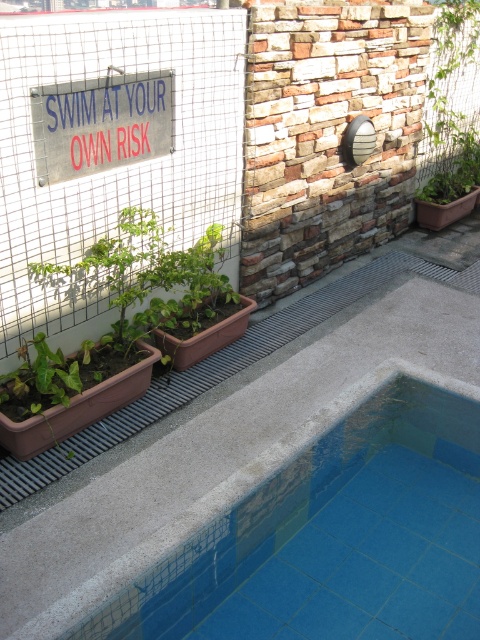
Question: Which object is the farthest from the blue tile swimming pool at lower center?

Choices:
 (A) metallic sign at upper left
 (B) green leafy plant at upper right

Answer: (B)

Question: Among these objects, which one is farthest from the camera?

Choices:
 (A) green leafy plant at upper right
 (B) metallic sign at upper left
 (C) blue tile swimming pool at lower center

Answer: (A)

Question: Is blue tile swimming pool at lower center bigger than metallic sign at upper left?

Choices:
 (A) yes
 (B) no

Answer: (A)

Question: Does metallic sign at upper left have a larger size compared to green leafy plant at upper right?

Choices:
 (A) no
 (B) yes

Answer: (A)

Question: Is blue tile swimming pool at lower center above metallic sign at upper left?

Choices:
 (A) yes
 (B) no

Answer: (B)

Question: Which of these objects is positioned closest to the green leafy plant at upper right?

Choices:
 (A) metallic sign at upper left
 (B) blue tile swimming pool at lower center

Answer: (A)